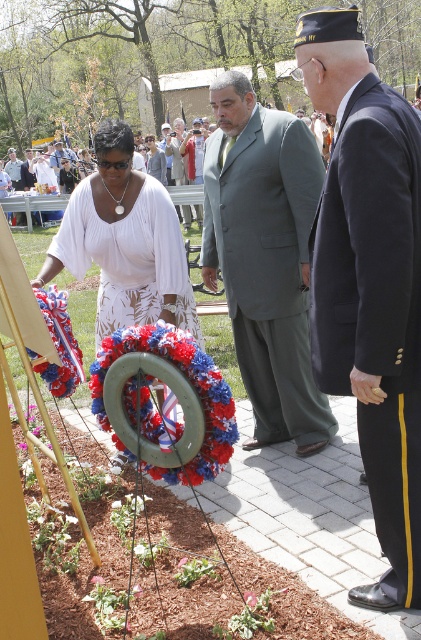
Question: Which point is closer to the camera taking this photo?

Choices:
 (A) (15, 164)
 (B) (247, 112)

Answer: (B)

Question: Which of the following is the closest to the observer?

Choices:
 (A) light gray suit at center
 (B) black wool suit at right

Answer: (B)

Question: Can you confirm if white satin dress at center is positioned above fuzzy fabric wreath at center?

Choices:
 (A) no
 (B) yes

Answer: (B)

Question: Can you confirm if black wool suit at right is positioned to the right of light blue fabric shirt at center?

Choices:
 (A) yes
 (B) no

Answer: (A)

Question: Among these points, which one is nearest to the camera?

Choices:
 (A) (144, 228)
 (B) (12, 154)
 (C) (173, 132)
 (D) (207, 433)

Answer: (D)

Question: Can you confirm if black wool suit at right is positioned to the left of gray suit at center?

Choices:
 (A) no
 (B) yes

Answer: (A)